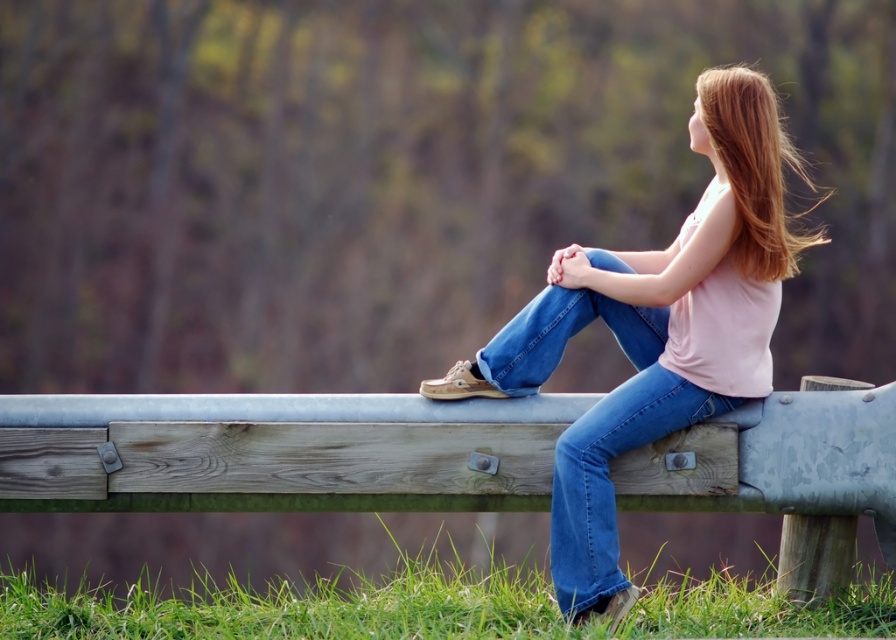
Question: Does denim jeans at center come in front of shiny brown hair at upper right?

Choices:
 (A) yes
 (B) no

Answer: (A)

Question: Which is farther from the wooden bench at center?

Choices:
 (A) denim jeans at center
 (B) shiny brown hair at upper right
 (C) blue denim jeans at center

Answer: (B)

Question: Which point is farther from the camera taking this photo?

Choices:
 (A) (7, 460)
 (B) (811, 188)
 (C) (636, 326)

Answer: (B)

Question: Can you confirm if denim jeans at center is bigger than blue denim jeans at center?

Choices:
 (A) yes
 (B) no

Answer: (A)

Question: Where is blue denim jeans at center located in relation to shiny brown hair at upper right in the image?

Choices:
 (A) below
 (B) above

Answer: (A)

Question: Which of these objects is positioned farthest from the blue denim jeans at center?

Choices:
 (A) wooden bench at center
 (B) denim jeans at center
 (C) shiny brown hair at upper right

Answer: (C)